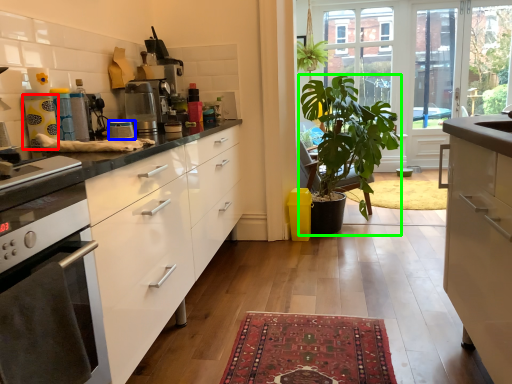
Question: Which object is positioned closest to appliance (highlighted by a red box)? Select from appliance (highlighted by a blue box) and houseplant (highlighted by a green box).

Choices:
 (A) appliance
 (B) houseplant

Answer: (A)